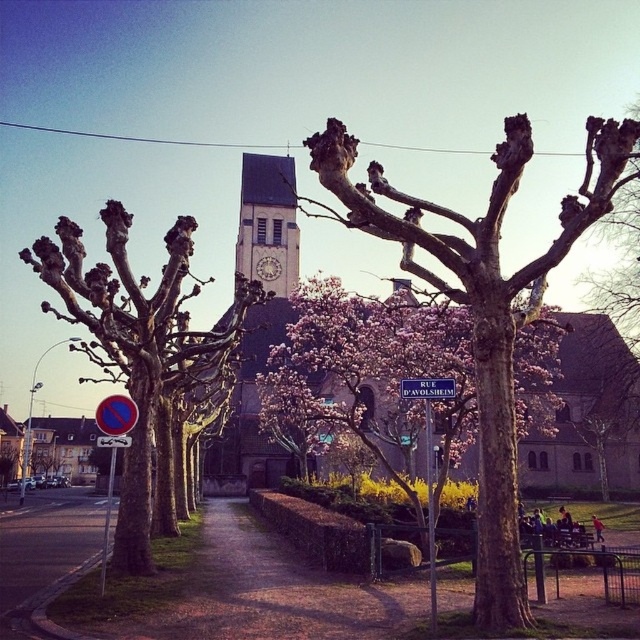
Which of these two, brown dirt path at center or blue plastic sign at center, stands taller?

brown dirt path at center is taller.

Can you confirm if brown dirt path at center is wider than blue plastic sign at center?

Yes.

Is point (109, 627) positioned before point (131, 397)?

Yes, point (109, 627) is closer to viewer.

This screenshot has width=640, height=640. Identify the location of brown dirt path at center. pyautogui.click(x=244, y=593).

Does bare wood tree at center appear on the right side of bare bark tree at left?

Indeed, bare wood tree at center is positioned on the right side of bare bark tree at left.

At what (x,y) coordinates should I click in order to perform the action: click on bare wood tree at center. Please return your answer as a coordinate pair (x, y). This screenshot has width=640, height=640. Looking at the image, I should click on tap(483, 307).

Looking at this image, is blue plastic sign at center bigger than blue plastic street sign at center?

Yes, blue plastic sign at center is bigger than blue plastic street sign at center.

Who is higher up, blue plastic sign at center or blue plastic street sign at center?

blue plastic street sign at center

Between point (116, 422) and point (420, 387), which one is positioned in front?

Point (420, 387)

Find the location of `blue plastic sign at center`. blue plastic sign at center is located at coordinates 115,413.